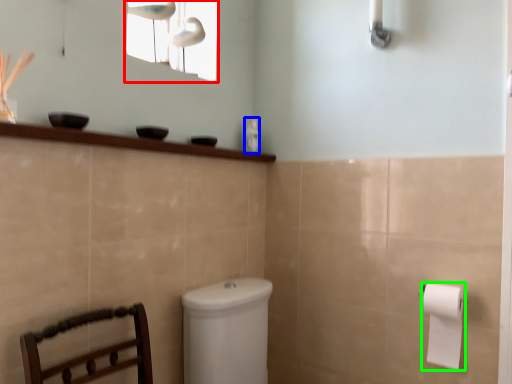
Question: Estimate the real-world distances between objects in this image. Which object is closer to window screen (highlighted by a red box), toiletry (highlighted by a blue box) or toilet paper (highlighted by a green box)?

Choices:
 (A) toiletry
 (B) toilet paper

Answer: (A)